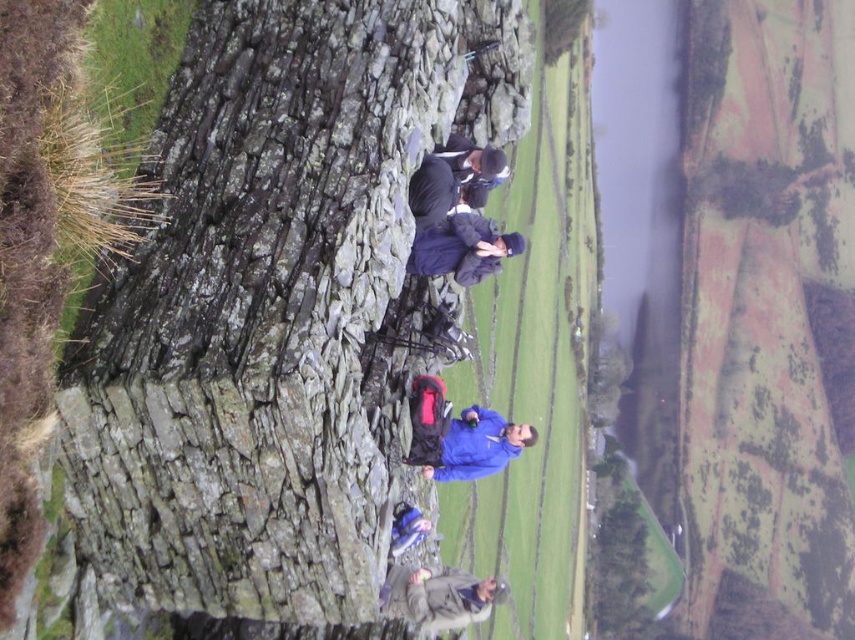
Who is taller, dark gray jacket at lower center or dark blue down jacket at center?

dark gray jacket at lower center is taller.

The width and height of the screenshot is (855, 640). What do you see at coordinates (438, 596) in the screenshot?
I see `dark gray jacket at lower center` at bounding box center [438, 596].

Locate an element on the screen. The width and height of the screenshot is (855, 640). dark gray jacket at lower center is located at coordinates coord(438,596).

Which is below, rough stone wall at center or dark gray jacket at lower center?

dark gray jacket at lower center is lower down.

In the scene shown: Is rough stone wall at center bigger than dark gray jacket at lower center?

Yes.

Image resolution: width=855 pixels, height=640 pixels. I want to click on rough stone wall at center, so click(270, 304).

Is rough stone wall at center further to the viewer compared to dark blue down jacket at center?

That is False.

In the scene shown: Can you confirm if rough stone wall at center is thinner than dark blue down jacket at center?

Incorrect, rough stone wall at center's width is not less than dark blue down jacket at center's.

Does point (320, 529) come behind point (493, 264)?

No, it is not.

This screenshot has height=640, width=855. What are the coordinates of `rough stone wall at center` in the screenshot? It's located at (270, 304).